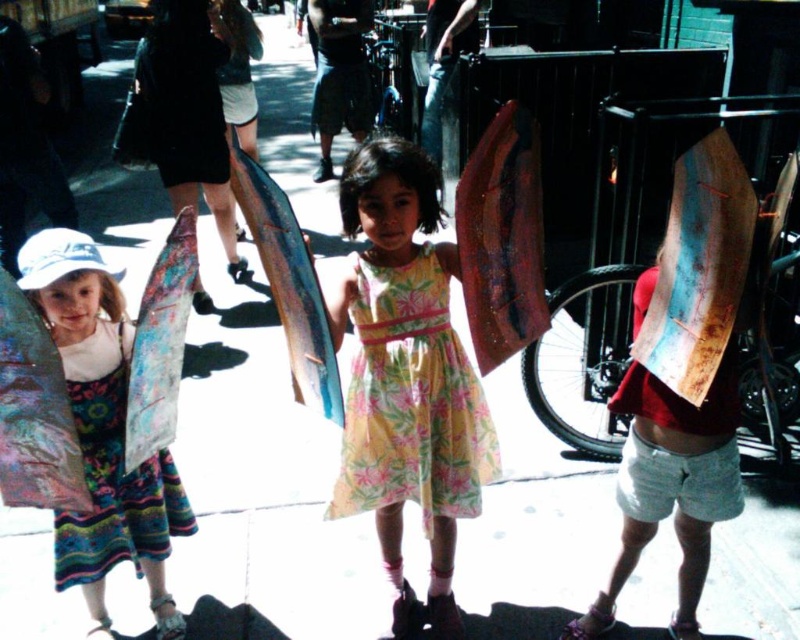
Does point (88, 477) come farther from viewer compared to point (56, 490)?

Yes, it is behind point (56, 490).

Which is more to the left, multicolored floral dress at left or shiny metallic surfboard at left?

From the viewer's perspective, shiny metallic surfboard at left appears more on the left side.

Which is behind, point (164, 483) or point (12, 307)?

Positioned behind is point (164, 483).

The height and width of the screenshot is (640, 800). In order to click on multicolored floral dress at left in this screenshot , I will do `click(114, 481)`.

Measure the distance between point (724, 419) and camera.

Point (724, 419) and camera are 2.08 meters apart.

Consider the image. Does wooden signboard at right appear under shiny metallic surfboard at left?

Yes.

Where is `wooden signboard at right`? The image size is (800, 640). wooden signboard at right is located at coordinates (672, 484).

Based on the photo, does multicolored floral dress at left have a smaller size compared to floral fabric surfboard at left?

No, multicolored floral dress at left is not smaller than floral fabric surfboard at left.

Is multicolored floral dress at left wider than floral fabric surfboard at left?

Indeed, multicolored floral dress at left has a greater width compared to floral fabric surfboard at left.

Where is `multicolored floral dress at left`? Image resolution: width=800 pixels, height=640 pixels. multicolored floral dress at left is located at coordinates (114, 481).

In order to click on multicolored floral dress at left in this screenshot , I will do pos(114,481).